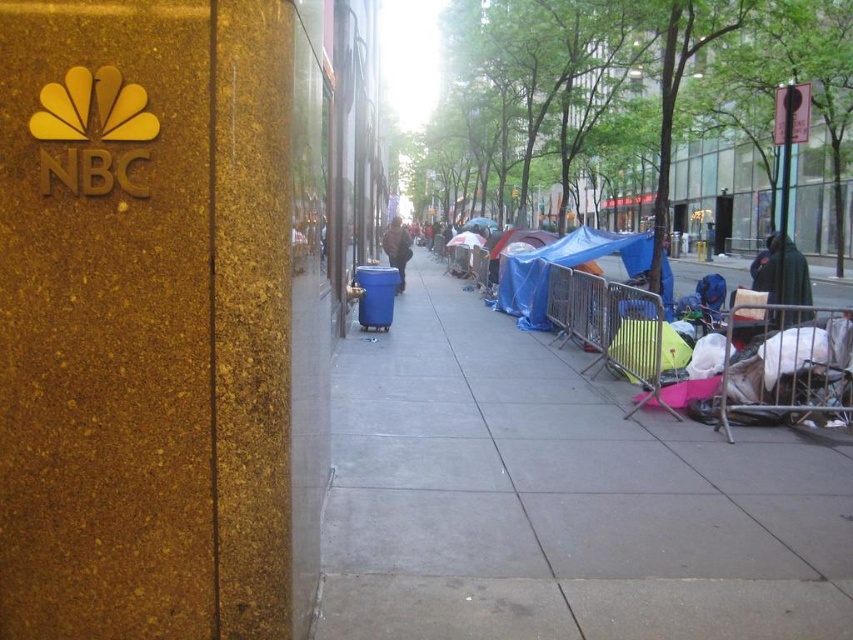
Question: Can you confirm if concrete sidewalk at center is thinner than white fabric baby carriage at lower right?

Choices:
 (A) yes
 (B) no

Answer: (B)

Question: Among these points, which one is nearest to the camera?

Choices:
 (A) (397, 221)
 (B) (805, 372)
 (C) (759, 273)

Answer: (B)

Question: Which point appears closest to the camera in this image?

Choices:
 (A) (396, 252)
 (B) (750, 268)

Answer: (A)

Question: Does white fabric baby carriage at lower right appear on the right side of brown fuzzy coat at center?

Choices:
 (A) yes
 (B) no

Answer: (A)

Question: Does concrete sidewalk at center have a smaller size compared to dark blue fabric at center?

Choices:
 (A) yes
 (B) no

Answer: (A)

Question: Which point appears closest to the camera in this image?

Choices:
 (A) (752, 260)
 (B) (387, 419)
 (C) (399, 243)

Answer: (B)